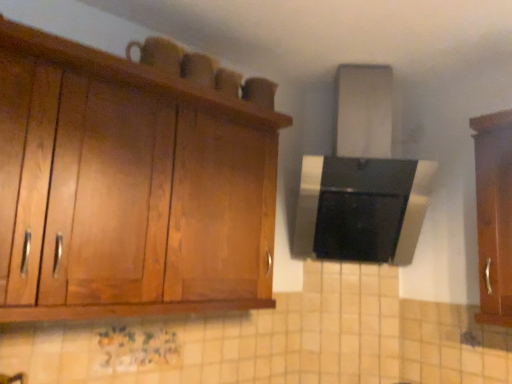
The width and height of the screenshot is (512, 384). Describe the element at coordinates (494, 215) in the screenshot. I see `wooden cabinet at right, which is the 2th cabinetry in left-to-right order` at that location.

Locate an element on the screen. Image resolution: width=512 pixels, height=384 pixels. wooden cabinet at right, which is the 2th cabinetry in left-to-right order is located at coordinates (494, 215).

What do you see at coordinates (134, 181) in the screenshot? I see `wooden cabinet at upper left, the second cabinetry from the right` at bounding box center [134, 181].

At what (x,y) coordinates should I click in order to perform the action: click on wooden cabinet at upper left, arranged as the 1th cabinetry when viewed from the left. Please return your answer as a coordinate pair (x, y). This screenshot has height=384, width=512. Looking at the image, I should click on (134, 181).

How much space does wooden cabinet at upper left, arranged as the 1th cabinetry when viewed from the left, occupy horizontally?

wooden cabinet at upper left, arranged as the 1th cabinetry when viewed from the left, is 17.59 inches in width.

The image size is (512, 384). I want to click on wooden cabinet at right, which is the 1th cabinetry from right to left, so click(494, 215).

Which object is positioned more to the right, wooden cabinet at upper left, the second cabinetry from the right, or wooden cabinet at right, which is the 2th cabinetry in left-to-right order?

wooden cabinet at right, which is the 2th cabinetry in left-to-right order.

Is the depth of wooden cabinet at upper left, arranged as the 1th cabinetry when viewed from the left, greater than that of wooden cabinet at right, which is the 1th cabinetry from right to left?

No, it is not.

Considering the points (108, 171) and (496, 120), which point is in front, point (108, 171) or point (496, 120)?

The point (108, 171) is in front.

From the image's perspective, between wooden cabinet at upper left, the second cabinetry from the right, and wooden cabinet at right, which is the 2th cabinetry in left-to-right order, who is located below?

wooden cabinet at right, which is the 2th cabinetry in left-to-right order, appears lower in the image.

From a real-world perspective, between wooden cabinet at upper left, the second cabinetry from the right, and wooden cabinet at right, which is the 1th cabinetry from right to left, who is vertically lower?

In real-world perspective, wooden cabinet at upper left, the second cabinetry from the right, is lower.

Considering the sizes of objects wooden cabinet at upper left, arranged as the 1th cabinetry when viewed from the left, and wooden cabinet at right, which is the 2th cabinetry in left-to-right order, in the image provided, who is wider, wooden cabinet at upper left, arranged as the 1th cabinetry when viewed from the left, or wooden cabinet at right, which is the 2th cabinetry in left-to-right order,?

Wider between the two is wooden cabinet at upper left, arranged as the 1th cabinetry when viewed from the left.

Can you confirm if wooden cabinet at upper left, arranged as the 1th cabinetry when viewed from the left, is shorter than wooden cabinet at right, which is the 1th cabinetry from right to left?

Indeed, wooden cabinet at upper left, arranged as the 1th cabinetry when viewed from the left, has a lesser height compared to wooden cabinet at right, which is the 1th cabinetry from right to left.

Looking at this image, between wooden cabinet at upper left, the second cabinetry from the right, and wooden cabinet at right, which is the 1th cabinetry from right to left, which one has smaller size?

Smaller between the two is wooden cabinet at right, which is the 1th cabinetry from right to left.

Is wooden cabinet at right, which is the 2th cabinetry in left-to-right order, inside wooden cabinet at upper left, the second cabinetry from the right?

Actually, wooden cabinet at right, which is the 2th cabinetry in left-to-right order, is outside wooden cabinet at upper left, the second cabinetry from the right.

Is wooden cabinet at upper left, the second cabinetry from the right, next to wooden cabinet at right, which is the 2th cabinetry in left-to-right order, and touching it?

No, wooden cabinet at upper left, the second cabinetry from the right, is not touching wooden cabinet at right, which is the 2th cabinetry in left-to-right order.

Does wooden cabinet at upper left, the second cabinetry from the right, turn towards wooden cabinet at right, which is the 1th cabinetry from right to left?

No, wooden cabinet at upper left, the second cabinetry from the right, is not turned towards wooden cabinet at right, which is the 1th cabinetry from right to left.

I want to click on cabinetry that is behind the wooden cabinet at upper left, the second cabinetry from the right, so click(x=494, y=215).

In the image, is wooden cabinet at right, which is the 1th cabinetry from right to left, on the left side or the right side of wooden cabinet at upper left, arranged as the 1th cabinetry when viewed from the left?

In the image, wooden cabinet at right, which is the 1th cabinetry from right to left, appears on the right side of wooden cabinet at upper left, arranged as the 1th cabinetry when viewed from the left.

Considering the positions of objects wooden cabinet at right, which is the 2th cabinetry in left-to-right order, and wooden cabinet at upper left, arranged as the 1th cabinetry when viewed from the left, in the image provided, who is in front, wooden cabinet at right, which is the 2th cabinetry in left-to-right order, or wooden cabinet at upper left, arranged as the 1th cabinetry when viewed from the left,?

wooden cabinet at upper left, arranged as the 1th cabinetry when viewed from the left, is more forward.

Which is nearer, [478,198] or [108,262]?

The point [108,262] is more forward.

From the image's perspective, which one is positioned higher, wooden cabinet at right, which is the 2th cabinetry in left-to-right order, or wooden cabinet at upper left, arranged as the 1th cabinetry when viewed from the left?

wooden cabinet at upper left, arranged as the 1th cabinetry when viewed from the left.

From a real-world perspective, is wooden cabinet at right, which is the 2th cabinetry in left-to-right order, under wooden cabinet at upper left, arranged as the 1th cabinetry when viewed from the left?

Incorrect, from a real-world perspective, wooden cabinet at right, which is the 2th cabinetry in left-to-right order, is higher than wooden cabinet at upper left, arranged as the 1th cabinetry when viewed from the left.

Does wooden cabinet at right, which is the 2th cabinetry in left-to-right order, have a greater width compared to wooden cabinet at upper left, the second cabinetry from the right?

No.

Between wooden cabinet at right, which is the 1th cabinetry from right to left, and wooden cabinet at upper left, arranged as the 1th cabinetry when viewed from the left, which one has more height?

With more height is wooden cabinet at right, which is the 1th cabinetry from right to left.

In the scene shown: Looking at the image, does wooden cabinet at right, which is the 2th cabinetry in left-to-right order, seem bigger or smaller compared to wooden cabinet at upper left, the second cabinetry from the right?

Considering their sizes, wooden cabinet at right, which is the 2th cabinetry in left-to-right order, takes up less space than wooden cabinet at upper left, the second cabinetry from the right.

Is wooden cabinet at right, which is the 2th cabinetry in left-to-right order, outside of wooden cabinet at upper left, arranged as the 1th cabinetry when viewed from the left?

wooden cabinet at right, which is the 2th cabinetry in left-to-right order, lies outside wooden cabinet at upper left, arranged as the 1th cabinetry when viewed from the left,'s area.

Is wooden cabinet at right, which is the 2th cabinetry in left-to-right order, not near wooden cabinet at upper left, the second cabinetry from the right?

wooden cabinet at right, which is the 2th cabinetry in left-to-right order, is far away from wooden cabinet at upper left, the second cabinetry from the right.

Is wooden cabinet at right, which is the 2th cabinetry in left-to-right order, oriented away from wooden cabinet at upper left, the second cabinetry from the right?

No, wooden cabinet at right, which is the 2th cabinetry in left-to-right order, is not facing the opposite direction of wooden cabinet at upper left, the second cabinetry from the right.

How different are the orientations of wooden cabinet at right, which is the 2th cabinetry in left-to-right order, and wooden cabinet at upper left, arranged as the 1th cabinetry when viewed from the left, in degrees?

The angular difference between wooden cabinet at right, which is the 2th cabinetry in left-to-right order, and wooden cabinet at upper left, arranged as the 1th cabinetry when viewed from the left, is 84.7 degrees.

How much distance is there between wooden cabinet at right, which is the 1th cabinetry from right to left, and wooden cabinet at upper left, arranged as the 1th cabinetry when viewed from the left?

They are 1.14 meters apart.

You are a GUI agent. You are given a task and a screenshot of the screen. Output one action in this format:
    pyautogui.click(x=<x>, y=<y>)
    Task: Click on the cabinetry in front of the wooden cabinet at right, which is the 2th cabinetry in left-to-right order
    The width and height of the screenshot is (512, 384).
    Given the screenshot: What is the action you would take?
    pyautogui.click(x=134, y=181)

This screenshot has height=384, width=512. There is a wooden cabinet at upper left, arranged as the 1th cabinetry when viewed from the left. In order to click on cabinetry above it (from a real-world perspective) in this screenshot , I will do `click(494, 215)`.

I want to click on cabinetry on the left of wooden cabinet at right, which is the 2th cabinetry in left-to-right order, so click(x=134, y=181).